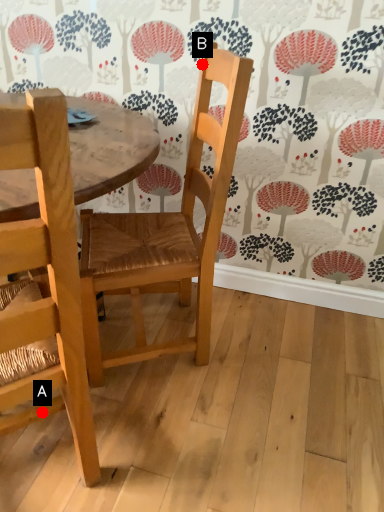
Question: Two points are circled on the image, labeled by A and B beside each circle. Among these points, which one is farthest from the camera?

Choices:
 (A) A is further
 (B) B is further

Answer: (B)